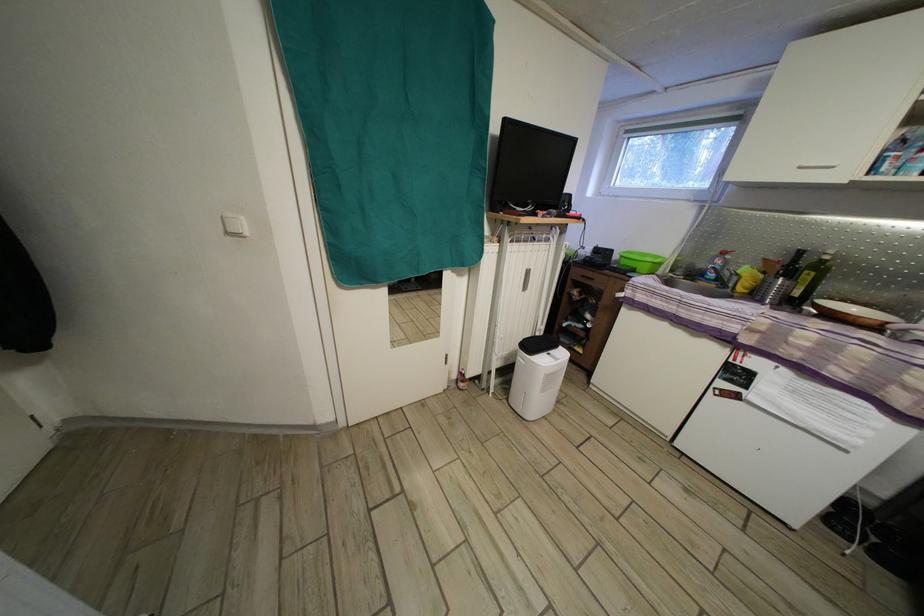
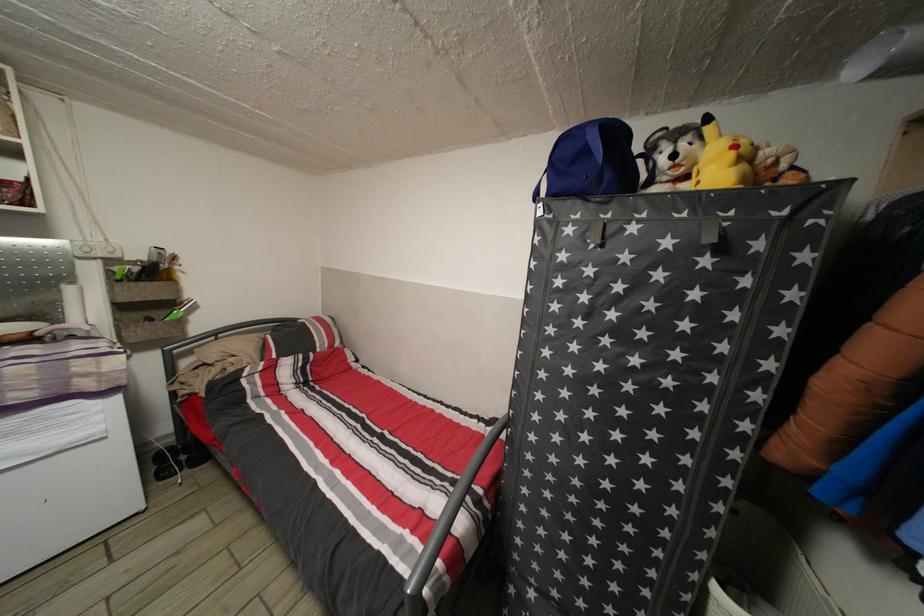
The point at (876, 519) is marked in the first image. Where is the corresponding point in the second image?

(177, 455)